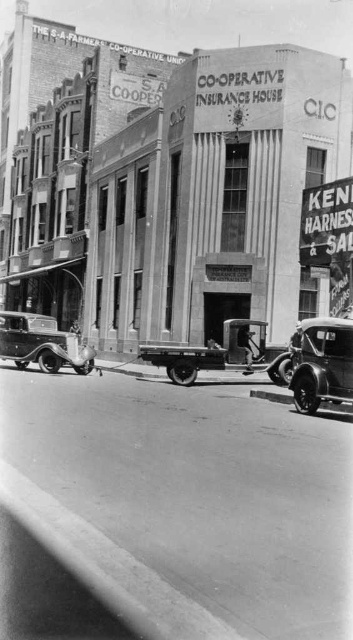
You are a pedestrian standing on the sidewalk looking at the two cars in the image. Which car, the shiny chrome car at right or the shiny silver car at lower left, is positioned more to the east if the image is oriented with north at the top?

The shiny chrome car at right is positioned to the right of the shiny silver car at lower left. Since the image is oriented with north at the top, right would correspond to east. Therefore, the shiny chrome car at right is more to the east.

You are standing at the curb on the left side of the street. You want to walk to the shiny chrome car at right. What direction should you walk in?

You should walk to the right because the shiny chrome car at right is located at point (322,364), which is to the right of your current position at the curb on the left side of the street.